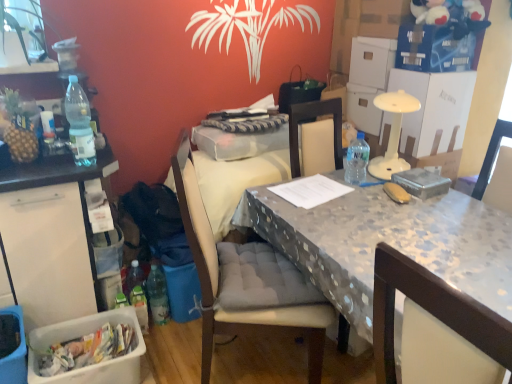
The width and height of the screenshot is (512, 384). In order to click on translucent plastic bottle at left, which is counted as the 3th bottle, starting from the bottom in this screenshot , I will do `click(79, 124)`.

This screenshot has width=512, height=384. Identify the location of white plastic container at lower left. (91, 365).

Locate an element on the screen. transparent plastic bottle at table right, the 2th bottle positioned from the front is located at coordinates (357, 160).

The image size is (512, 384). What do you see at coordinates (15, 353) in the screenshot? I see `plastic picnic basket at lower left` at bounding box center [15, 353].

Locate an element on the screen. This screenshot has height=384, width=512. white plastic bin at left is located at coordinates coord(52,235).

Which is in front, point (116, 383) or point (7, 379)?

The point (7, 379) is in front.

Consider the image. Does white plastic container at lower left have a greater height compared to plastic picnic basket at lower left?

No, white plastic container at lower left is not taller than plastic picnic basket at lower left.

Does white plastic container at lower left turn towards plastic picnic basket at lower left?

No, white plastic container at lower left does not turn towards plastic picnic basket at lower left.

In the scene shown: How far apart are white plastic container at lower left and plastic picnic basket at lower left?

white plastic container at lower left is 9.91 inches away from plastic picnic basket at lower left.

From a real-world perspective, is translucent plastic bottle at left, arranged as the first bottle when viewed from the left, physically above transparent plastic bottle at table right, arranged as the second bottle when ordered from the bottom?

Yes, from a real-world perspective, translucent plastic bottle at left, arranged as the first bottle when viewed from the left, is above transparent plastic bottle at table right, arranged as the second bottle when ordered from the bottom.

How different are the orientations of translucent plastic bottle at left, placed as the third bottle when sorted from right to left, and transparent plastic bottle at table right, the 1th bottle in the right-to-left sequence, in degrees?

6.53 degrees.

Considering the sizes of objects translucent plastic bottle at left, placed as the third bottle when sorted from right to left, and transparent plastic bottle at table right, the 2th bottle positioned from the front, in the image provided, who is smaller, translucent plastic bottle at left, placed as the third bottle when sorted from right to left, or transparent plastic bottle at table right, the 2th bottle positioned from the front,?

transparent plastic bottle at table right, the 2th bottle positioned from the front.

Between translucent plastic bottle at left, which is counted as the 3th bottle, starting from the bottom, and plastic picnic basket at lower left, which one has smaller size?

→ translucent plastic bottle at left, which is counted as the 3th bottle, starting from the bottom, is smaller.

Is plastic picnic basket at lower left at the back of translucent plastic bottle at left, the 1th bottle viewed from the top?

That's not correct — translucent plastic bottle at left, the 1th bottle viewed from the top, is not looking away from plastic picnic basket at lower left.

Which is behind, translucent plastic bottle at left, positioned as the 3th bottle in back-to-front order, or plastic picnic basket at lower left?

Positioned behind is translucent plastic bottle at left, positioned as the 3th bottle in back-to-front order.

From the image's perspective, which is below, translucent plastic bottle at left, the 1th bottle viewed from the top, or plastic picnic basket at lower left?

plastic picnic basket at lower left appears lower in the image.

Considering the relative sizes of fabric cushioned chair at center and translucent plastic bottle at left, placed as the third bottle when sorted from right to left, in the image provided, is fabric cushioned chair at center bigger than translucent plastic bottle at left, placed as the third bottle when sorted from right to left,?

Indeed, fabric cushioned chair at center has a larger size compared to translucent plastic bottle at left, placed as the third bottle when sorted from right to left.

At what (x,y) coordinates should I click in order to perform the action: click on chair lying on the right of translucent plastic bottle at left, the first bottle positioned from the front. Please return your answer as a coordinate pair (x, y). Looking at the image, I should click on 243,280.

How many degrees apart are the facing directions of fabric cushioned chair at center and translucent plastic bottle at left, which is counted as the 3th bottle, starting from the bottom?

They differ by 57 degrees in their facing directions.

Can you confirm if fabric cushioned chair at center is positioned to the right of translucent plastic bottle at left, arranged as the first bottle when viewed from the left?

Indeed, fabric cushioned chair at center is positioned on the right side of translucent plastic bottle at left, arranged as the first bottle when viewed from the left.

From the picture: Between polka dot fabric table at center and fabric cushioned chair at center, which one is positioned behind?

fabric cushioned chair at center.

Can you tell me how much polka dot fabric table at center and fabric cushioned chair at center differ in facing direction?

There is a 63.5-degree angle between the facing directions of polka dot fabric table at center and fabric cushioned chair at center.

Which of these two, polka dot fabric table at center or fabric cushioned chair at center, is smaller?

fabric cushioned chair at center is smaller.

Is polka dot fabric table at center not inside fabric cushioned chair at center?

polka dot fabric table at center is positioned outside fabric cushioned chair at center.

Does white plastic bin at left turn towards fabric cushioned chair at center?

No, white plastic bin at left is not turned towards fabric cushioned chair at center.

Who is taller, white plastic bin at left or fabric cushioned chair at center?

Standing taller between the two is fabric cushioned chair at center.

Which is more to the right, white plastic bin at left or fabric cushioned chair at center?

From the viewer's perspective, fabric cushioned chair at center appears more on the right side.

How distant is white plastic bin at left from fabric cushioned chair at center?

The distance of white plastic bin at left from fabric cushioned chair at center is 25.48 inches.

Between translucent plastic bottle at left, the 1th bottle viewed from the top, and polka dot fabric table at center, which one appears on the left side from the viewer's perspective?

translucent plastic bottle at left, the 1th bottle viewed from the top.

Which of these two, translucent plastic bottle at left, positioned as the 3th bottle in back-to-front order, or polka dot fabric table at center, is wider?

Wider between the two is polka dot fabric table at center.

Which object is more forward, translucent plastic bottle at left, the 1th bottle viewed from the top, or polka dot fabric table at center?

polka dot fabric table at center is more forward.

Can you see translucent plastic bottle at left, the 1th bottle viewed from the top, touching polka dot fabric table at center?

No, translucent plastic bottle at left, the 1th bottle viewed from the top, is not with polka dot fabric table at center.

Where is `picnic basket on the left of white plastic container at lower left`? Image resolution: width=512 pixels, height=384 pixels. picnic basket on the left of white plastic container at lower left is located at coordinates (15, 353).

Identify the location of bottle in front of the transparent plastic bottle at table right, positioned as the 3th bottle in left-to-right order. The height and width of the screenshot is (384, 512). (79, 124).

Looking at the image, which one is located further to fabric cushioned chair at center, plastic picnic basket at lower left or transparent plastic bottle at table right, the 1th bottle in the right-to-left sequence?

The object further to fabric cushioned chair at center is plastic picnic basket at lower left.

Which object lies nearer to the anchor point translucent plastic bottle at left, arranged as the first bottle when viewed from the left, polka dot fabric table at center or white plastic container at lower left?

white plastic container at lower left.

Estimate the real-world distances between objects in this image. Which object is closer to translucent plastic bottle at left, which is counted as the 3th bottle, starting from the bottom, translucent plastic bottle at lower left, which ranks as the 1th bottle in bottom-to-top order, or fabric cushioned chair at center?

Among the two, fabric cushioned chair at center is located nearer to translucent plastic bottle at left, which is counted as the 3th bottle, starting from the bottom.

Considering their positions, is fabric cushioned chair at center positioned further to plastic picnic basket at lower left than polka dot fabric table at center?

polka dot fabric table at center is positioned further to the anchor plastic picnic basket at lower left.

From the image, which object appears to be nearer to translucent plastic bottle at left, the 1th bottle viewed from the top, fabric cushioned chair at center or polka dot fabric table at center?

fabric cushioned chair at center lies closer to translucent plastic bottle at left, the 1th bottle viewed from the top, than the other object.

Based on their spatial positions, is white plastic container at lower left or transparent plastic bottle at table right, positioned as the 3th bottle in left-to-right order, further from fabric cushioned chair at center?

The object further to fabric cushioned chair at center is transparent plastic bottle at table right, positioned as the 3th bottle in left-to-right order.

From the image, which object appears to be farther from polka dot fabric table at center, transparent plastic bottle at table right, the 1th bottle in the right-to-left sequence, or plastic picnic basket at lower left?

plastic picnic basket at lower left is further to polka dot fabric table at center.

When comparing their distances from translucent plastic bottle at lower left, acting as the 2th bottle starting from the left, does white plastic bin at left or translucent plastic bottle at left, positioned as the 3th bottle in back-to-front order, seem closer?

The object closer to translucent plastic bottle at lower left, acting as the 2th bottle starting from the left, is white plastic bin at left.

You are a GUI agent. You are given a task and a screenshot of the screen. Output one action in this format:
    pyautogui.click(x=<x>, y=<y>)
    Task: Click on the box located between white plastic bin at left and polka dot fabric table at center in the left-right direction
    The height and width of the screenshot is (384, 512).
    Given the screenshot: What is the action you would take?
    pyautogui.click(x=91, y=365)

Image resolution: width=512 pixels, height=384 pixels. I want to click on chair located between white plastic bin at left and polka dot fabric table at center in the left-right direction, so click(x=243, y=280).

I want to click on bottle located between translucent plastic bottle at lower left, the 2th bottle in the right-to-left sequence, and polka dot fabric table at center in the left-right direction, so click(x=357, y=160).

Locate an element on the screen. picnic basket between translucent plastic bottle at left, the first bottle positioned from the front, and white plastic container at lower left from top to bottom is located at coordinates (15, 353).